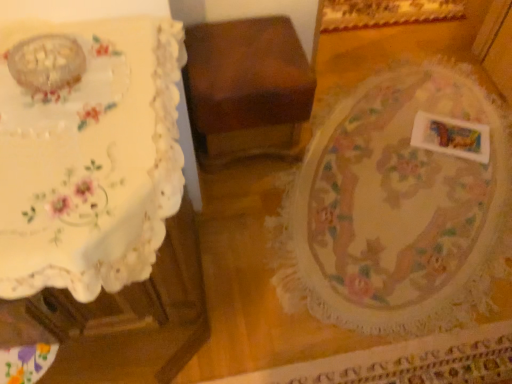
You are a GUI agent. You are given a task and a screenshot of the screen. Output one action in this format:
    pyautogui.click(x=<x>, y=<y>)
    Task: Click on the free space above floral lace tablecloth at center (from a real-world perspective)
    The width and height of the screenshot is (512, 384).
    Given the screenshot: What is the action you would take?
    pyautogui.click(x=418, y=182)